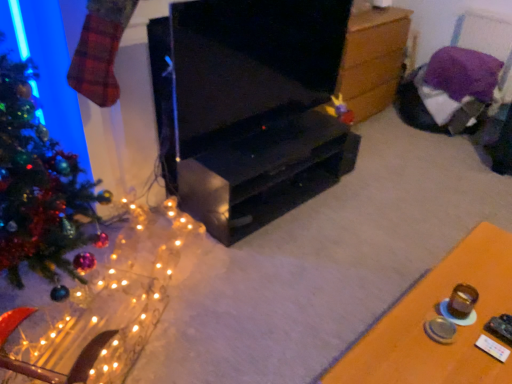
Question: From the image's perspective, is wooden chest at center, which is the second table from bottom to top, over purple fabric chair at upper right?

Choices:
 (A) yes
 (B) no

Answer: (A)

Question: Is wooden chest at center, which ranks as the first table in top-to-bottom order, shorter than purple fabric chair at upper right?

Choices:
 (A) yes
 (B) no

Answer: (B)

Question: From a real-world perspective, is wooden chest at center, acting as the 1th table starting from the back, positioned over purple fabric chair at upper right based on gravity?

Choices:
 (A) yes
 (B) no

Answer: (B)

Question: Can you confirm if wooden chest at center, acting as the 1th table starting from the back, is positioned to the left of purple fabric chair at upper right?

Choices:
 (A) no
 (B) yes

Answer: (B)

Question: Is wooden chest at center, acting as the 1th table starting from the back, smaller than purple fabric chair at upper right?

Choices:
 (A) yes
 (B) no

Answer: (B)

Question: From a real-world perspective, is wooden chest at center, which is the second table from bottom to top, physically below purple fabric chair at upper right?

Choices:
 (A) no
 (B) yes

Answer: (B)

Question: Does shiny green christmas tree at left appear on the right side of black matte tv cabinet at center?

Choices:
 (A) yes
 (B) no

Answer: (B)

Question: From the image's perspective, does shiny green christmas tree at left appear higher than black matte tv cabinet at center?

Choices:
 (A) yes
 (B) no

Answer: (A)

Question: Is shiny green christmas tree at left located outside black matte tv cabinet at center?

Choices:
 (A) no
 (B) yes

Answer: (B)

Question: Does shiny green christmas tree at left come in front of black matte tv cabinet at center?

Choices:
 (A) yes
 (B) no

Answer: (A)

Question: From a real-world perspective, is shiny green christmas tree at left on black matte tv cabinet at center?

Choices:
 (A) no
 (B) yes

Answer: (B)

Question: Considering the relative sizes of shiny green christmas tree at left and black matte tv cabinet at center in the image provided, is shiny green christmas tree at left smaller than black matte tv cabinet at center?

Choices:
 (A) no
 (B) yes

Answer: (B)

Question: Does illuminated wire mesh at left have a smaller size compared to black glossy tv stand at center?

Choices:
 (A) no
 (B) yes

Answer: (A)